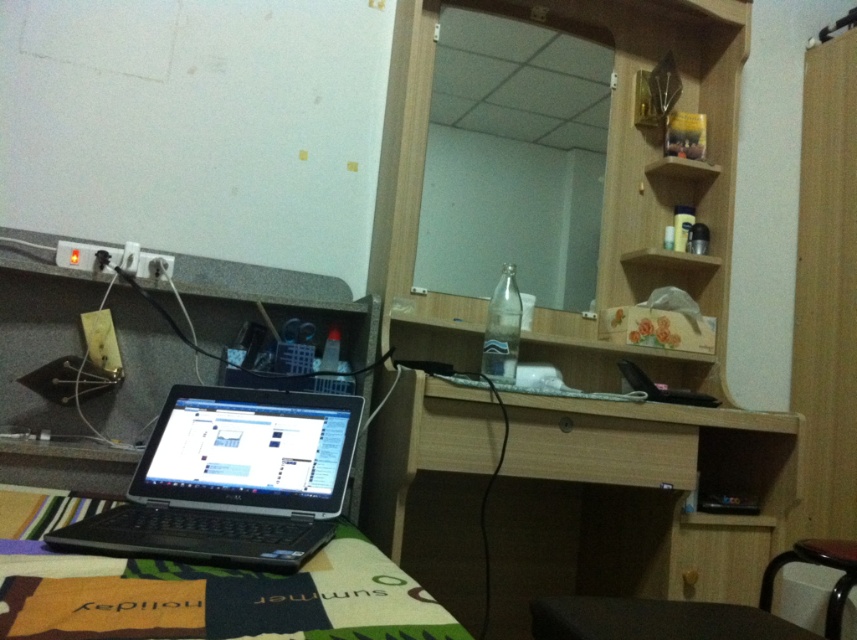
Is black plastic laptop at lower left wider than brown wooden stool at lower right?

Yes, black plastic laptop at lower left is wider than brown wooden stool at lower right.

Which is more to the left, black plastic laptop at lower left or brown wooden stool at lower right?

From the viewer's perspective, black plastic laptop at lower left appears more on the left side.

This screenshot has height=640, width=857. I want to click on black plastic laptop at lower left, so click(219, 600).

Does light wood/wooden computer desk at center appear on the left side of black plastic laptop at lower left?

Incorrect, light wood/wooden computer desk at center is not on the left side of black plastic laptop at lower left.

Identify the location of light wood/wooden computer desk at center. (632, 500).

Find the location of a particular element. The width and height of the screenshot is (857, 640). light wood/wooden computer desk at center is located at coordinates (632, 500).

This screenshot has height=640, width=857. What are the coordinates of `light wood/wooden computer desk at center` in the screenshot? It's located at (632, 500).

Does black plastic laptop at lower left appear on the left side of wooden drawer at center?

Yes, black plastic laptop at lower left is to the left of wooden drawer at center.

Can you confirm if black plastic laptop at lower left is positioned to the right of wooden drawer at center?

In fact, black plastic laptop at lower left is to the left of wooden drawer at center.

Image resolution: width=857 pixels, height=640 pixels. Identify the location of black plastic laptop at lower left. (219, 600).